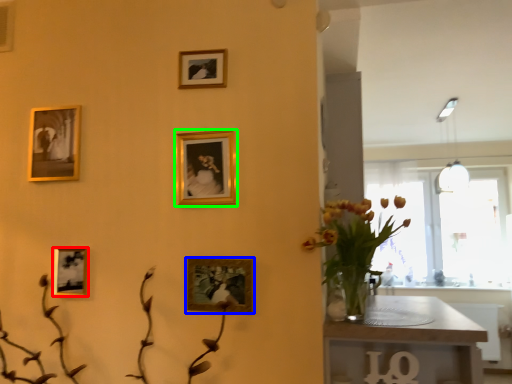
Question: Estimate the real-world distances between objects in this image. Which object is farther from picture frame (highlighted by a red box), picture frame (highlighted by a blue box) or picture frame (highlighted by a green box)?

Choices:
 (A) picture frame
 (B) picture frame

Answer: (B)